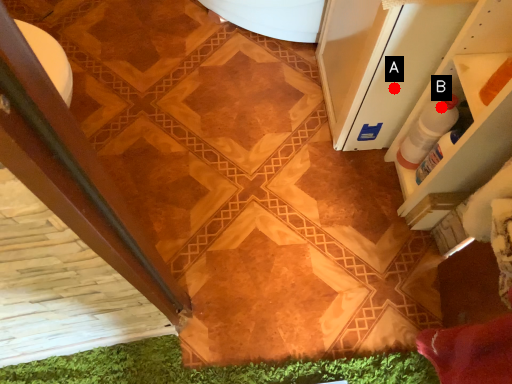
Question: Two points are circled on the image, labeled by A and B beside each circle. Which point is farther from the camera taking this photo?

Choices:
 (A) A is further
 (B) B is further

Answer: (A)